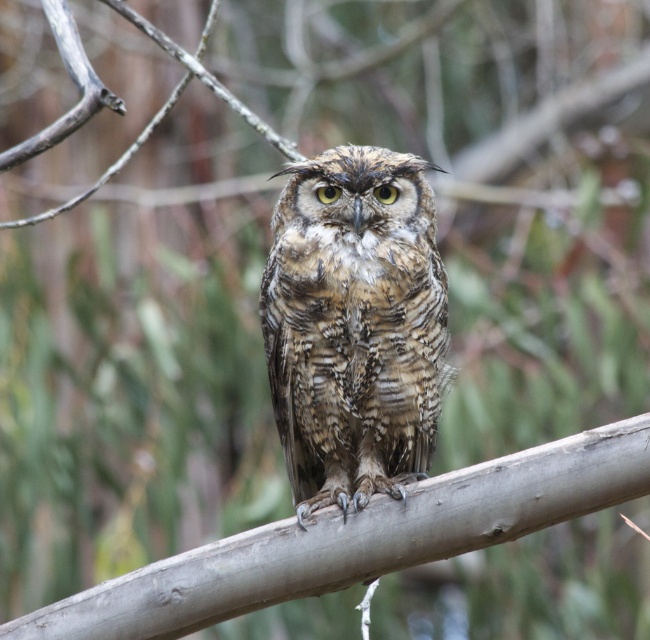
In the scene shown: You are a birdwatcher observing the scene. You notice the brown textured owl at center and the gray smooth branch at center. Which object is located above the other?

The brown textured owl at center is positioned over the gray smooth branch at center, meaning the owl is above the branch.

You are a birdwatcher observing the scene. You notice the brown textured owl at center and the gray smooth branch at center. Which object is closer to you?

The brown textured owl at center is closer to you because it is positioned further to the viewer than the gray smooth branch at center.